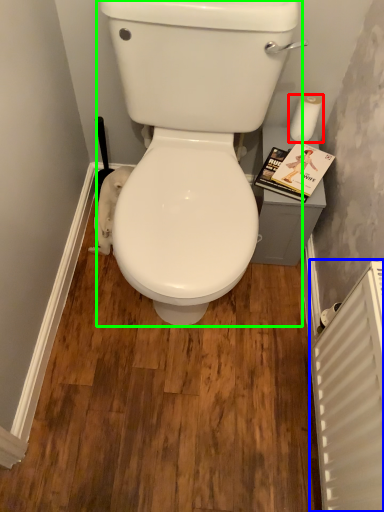
Question: Which object is the farthest from toilet paper (highlighted by a red box)? Choose among these: radiator (highlighted by a blue box) or porcelain (highlighted by a green box).

Choices:
 (A) radiator
 (B) porcelain

Answer: (A)